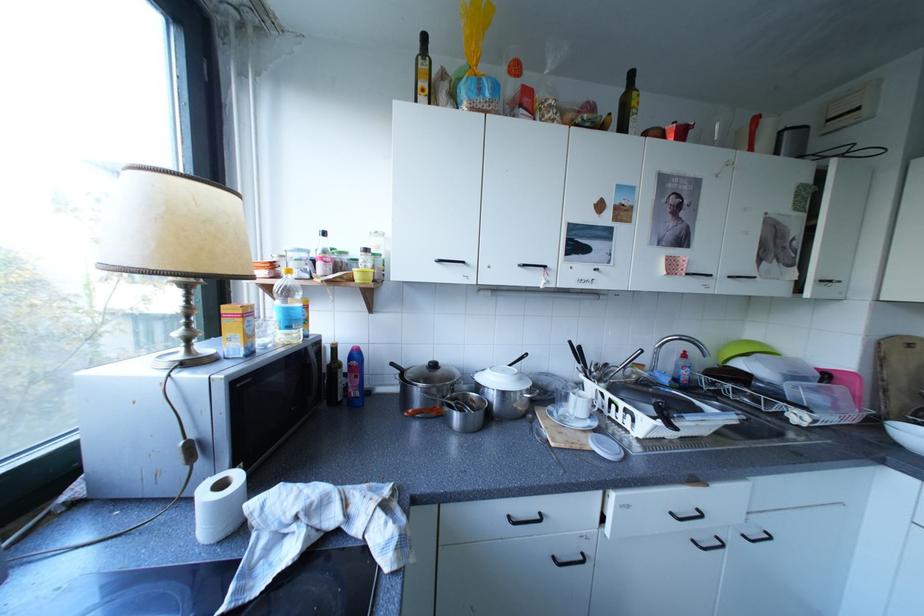
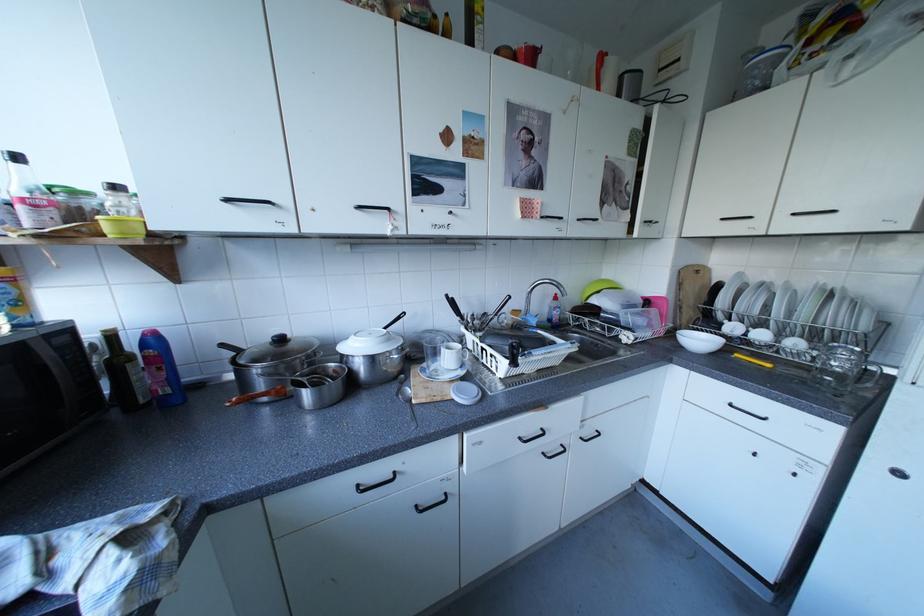
Question: The camera is either moving clockwise (left) or counter-clockwise (right) around the object. The first image is from the beginning of the video and the second image is from the end. Is the camera moving left or right when shooting the video?

Choices:
 (A) Left
 (B) Right

Answer: (A)